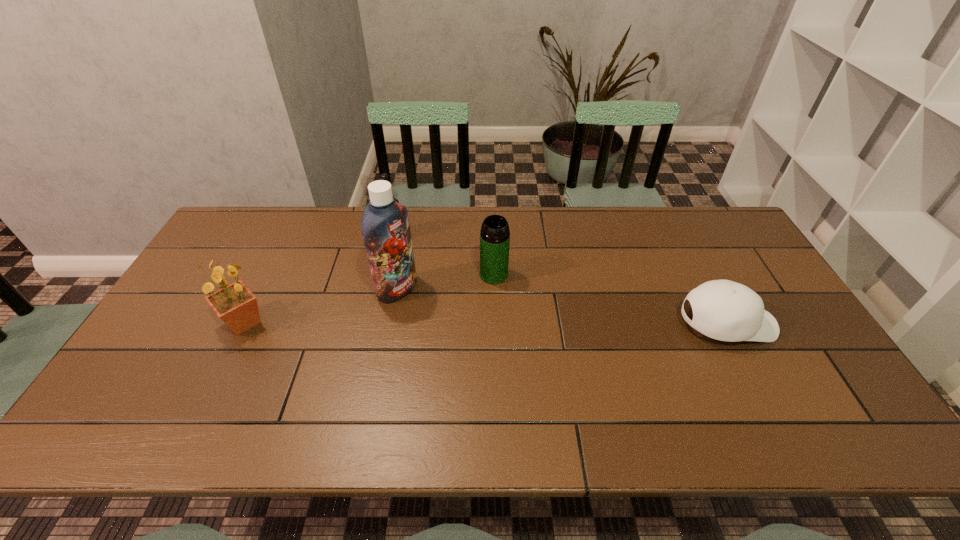
This screenshot has height=540, width=960. I want to click on the leftmost object, so click(235, 304).

Identify the location of the shortest object. (724, 310).

You are a GUI agent. You are given a task and a screenshot of the screen. Output one action in this format:
    pyautogui.click(x=<x>, y=<y>)
    Task: Click on the baseball cap
    The image size is (960, 540).
    Given the screenshot: What is the action you would take?
    pyautogui.click(x=724, y=310)

The height and width of the screenshot is (540, 960). Find the location of `vodka`. vodka is located at coordinates pos(384,176).

Locate an element on the screen. shampoo is located at coordinates (386, 233).

Locate an element on the screen. This screenshot has width=960, height=540. thermos bottle is located at coordinates (495, 235).

Locate an element on the screen. The height and width of the screenshot is (540, 960). free space located at the front of the leftmost object with flowers visible is located at coordinates (338, 322).

Find the location of a particular element. The width and height of the screenshot is (960, 540). vacant space located on the front-facing side of the baseball cap is located at coordinates coord(800,323).

Image resolution: width=960 pixels, height=540 pixels. Find the location of `free space located 0.130m on the label of the farthest object`. free space located 0.130m on the label of the farthest object is located at coordinates (423, 261).

Where is `vacant area situated 0.290m on the label of the farthest object`? vacant area situated 0.290m on the label of the farthest object is located at coordinates (455, 288).